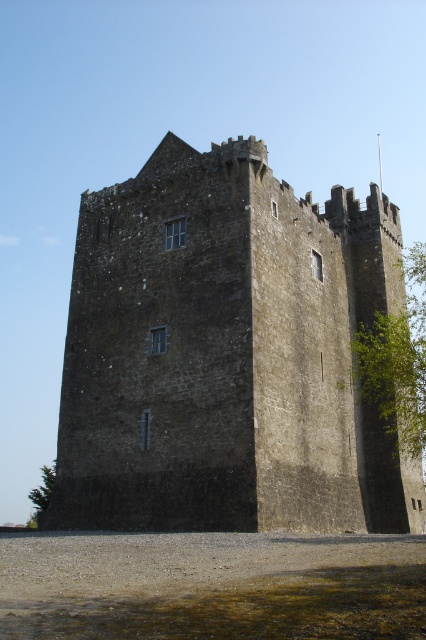
Who is more distant from viewer, (241, 244) or (420, 428)?

Point (420, 428)

Locate an element on the screen. The image size is (426, 640). rustic stone tower at center is located at coordinates (227, 355).

Which of these two, green leafy tree at right or green leafy tree at lower left, stands taller?

green leafy tree at lower left

Who is more forward, (x=412, y=392) or (x=42, y=472)?

Point (x=412, y=392) is more forward.

Where is `green leafy tree at right`? This screenshot has height=640, width=426. green leafy tree at right is located at coordinates (397, 360).

Who is more forward, (x=328, y=396) or (x=43, y=506)?

Point (x=328, y=396)

Where is `rustic stone tower at center`? rustic stone tower at center is located at coordinates (227, 355).